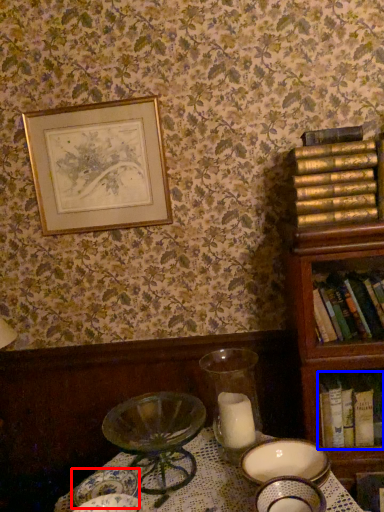
Question: Which of the following is the closest to the observer, tableware (highlighted by a red box) or book (highlighted by a blue box)?

Choices:
 (A) tableware
 (B) book

Answer: (A)